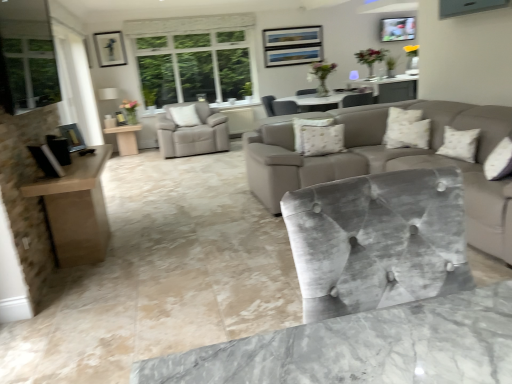
Question: From a real-world perspective, does white textured pillow at center, the first pillow when ordered from bottom to top, sit lower than metallic silver picture frame at upper right, arranged as the 1th picture frame when viewed from the top?

Choices:
 (A) yes
 (B) no

Answer: (A)

Question: Is white textured pillow at center, the 2th pillow positioned from the left, further to camera compared to metallic silver picture frame at upper right, the 1th picture frame viewed from the back?

Choices:
 (A) no
 (B) yes

Answer: (A)

Question: Is white textured pillow at center, which is counted as the second pillow, starting from the right, outside metallic silver picture frame at upper right, acting as the second picture frame starting from the bottom?

Choices:
 (A) yes
 (B) no

Answer: (A)

Question: Is white textured pillow at center, which is the second pillow in front-to-back order, taller than metallic silver picture frame at upper right, which is the 1th picture frame in right-to-left order?

Choices:
 (A) yes
 (B) no

Answer: (B)

Question: Is white textured pillow at center, which is the second pillow in front-to-back order, at the right side of metallic silver picture frame at upper right, which is the 1th picture frame in right-to-left order?

Choices:
 (A) yes
 (B) no

Answer: (B)

Question: From a real-world perspective, is white textured pillow at center, which is the second pillow in front-to-back order, located higher than metallic silver picture frame at upper right, the 1th picture frame viewed from the back?

Choices:
 (A) no
 (B) yes

Answer: (A)

Question: From a real-world perspective, is beige fabric pillow at center, marked as the 1th pillow in a left-to-right arrangement, physically above velvet grey chair at center, the second chair in the back-to-front sequence?

Choices:
 (A) no
 (B) yes

Answer: (A)

Question: Is beige fabric pillow at center, the third pillow when ordered from front to back, further to camera compared to velvet grey chair at center, placed as the 3th chair when sorted from left to right?

Choices:
 (A) no
 (B) yes

Answer: (B)

Question: From the image's perspective, is beige fabric pillow at center, marked as the 3th pillow in a bottom-to-top arrangement, beneath velvet grey chair at center, positioned as the second chair in bottom-to-top order?

Choices:
 (A) yes
 (B) no

Answer: (B)

Question: Does beige fabric pillow at center, the third pillow when ordered from front to back, touch velvet grey chair at center, the second chair in the back-to-front sequence?

Choices:
 (A) yes
 (B) no

Answer: (B)

Question: Does beige fabric pillow at center, marked as the 3th pillow in a bottom-to-top arrangement, appear on the right side of velvet grey chair at center, the 2th chair from the top?

Choices:
 (A) yes
 (B) no

Answer: (B)

Question: Can you confirm if beige fabric pillow at center, positioned as the 1th pillow in back-to-front order, is wider than velvet grey chair at center, placed as the 3th chair when sorted from left to right?

Choices:
 (A) no
 (B) yes

Answer: (A)

Question: From the image's perspective, does white textured pillow at center, which is counted as the second pillow, starting from the back, appear higher than beige fabric pillow at center, marked as the 1th pillow in a left-to-right arrangement?

Choices:
 (A) yes
 (B) no

Answer: (B)